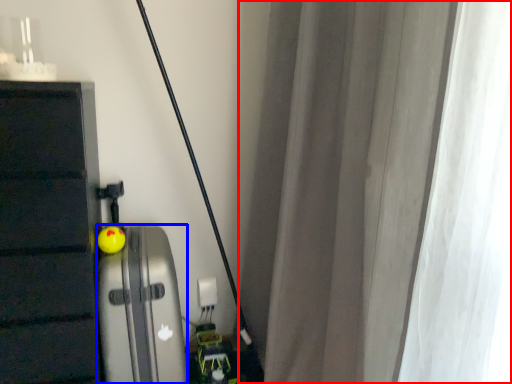
Question: Which object appears closest to the camera in this image, curtain (highlighted by a red box) or appliance (highlighted by a blue box)?

Choices:
 (A) curtain
 (B) appliance

Answer: (A)